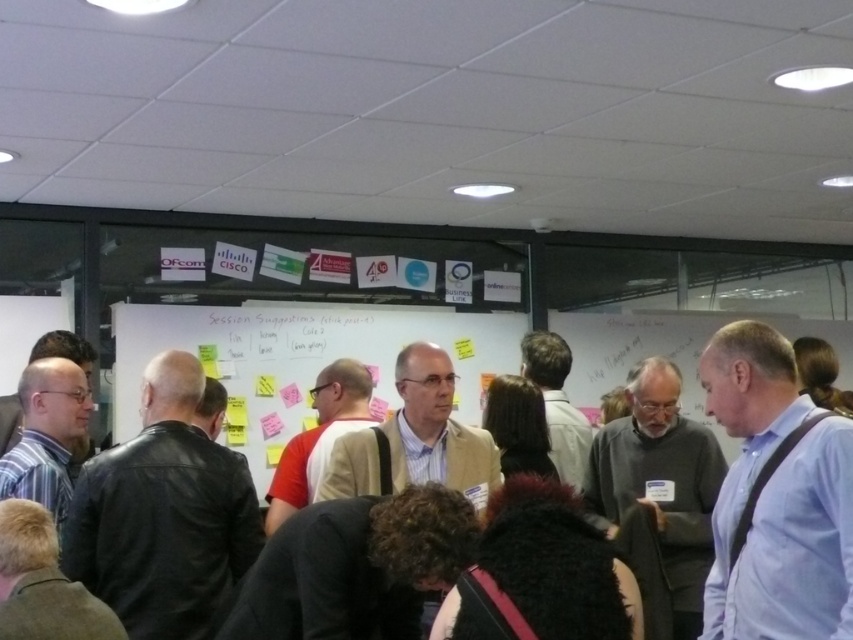
Can you confirm if blue shirt at center is positioned above dark brown leather jacket at center?

Incorrect, blue shirt at center is not positioned above dark brown leather jacket at center.

In the scene shown: Can you confirm if blue shirt at center is shorter than dark brown leather jacket at center?

Yes.

Measure the distance between point (772, 452) and camera.

2.33 meters

Where is `blue shirt at center`? The height and width of the screenshot is (640, 853). blue shirt at center is located at coordinates (776, 497).

Between blue shirt at center and white matte whiteboard at center, which one is positioned higher?

white matte whiteboard at center

Who is more distant from viewer, [793,625] or [347,326]?

Positioned behind is point [347,326].

Identify the location of blue shirt at center. Image resolution: width=853 pixels, height=640 pixels. (776, 497).

Between white matte whiteboard at center and dark brown leather jacket at center, which one is positioned higher?

dark brown leather jacket at center is above.

Is white matte whiteboard at center positioned behind dark brown leather jacket at center?

No, it is not.

Is point (132, 406) behind point (706, 474)?

Yes.

You are a GUI agent. You are given a task and a screenshot of the screen. Output one action in this format:
    pyautogui.click(x=<x>, y=<y>)
    Task: Click on the white matte whiteboard at center
    The image size is (853, 640).
    Given the screenshot: What is the action you would take?
    pyautogui.click(x=300, y=358)